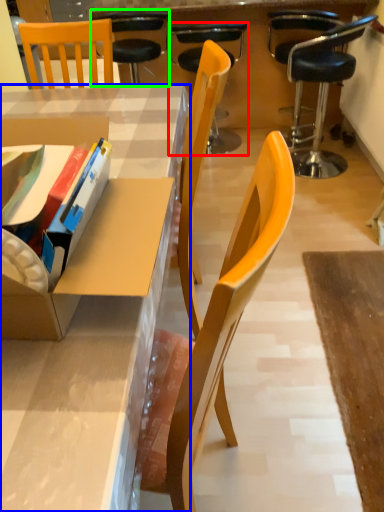
Question: Estimate the real-world distances between objects in this image. Which object is closer to chair (highlighted by a red box), desk (highlighted by a blue box) or chair (highlighted by a green box)?

Choices:
 (A) desk
 (B) chair

Answer: (B)